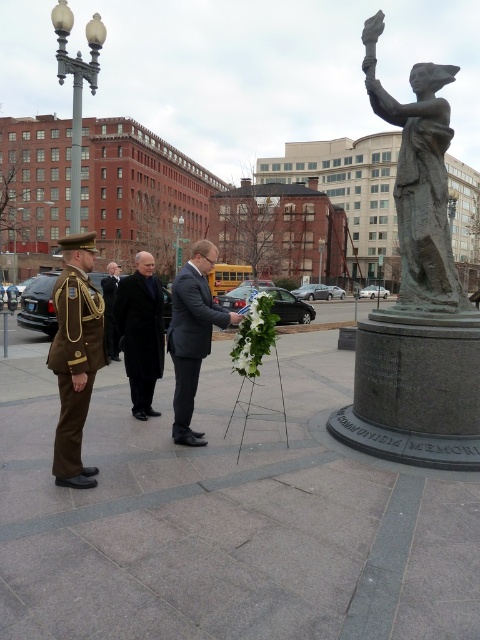
You are a photographer standing at the center of the scene. You want to capture a closeup shot of the statue on the right side of the frame. However, there is an object blocking your view at point (x=74, y=362). What is the object blocking your view?

The brown fabric uniform at left is located at point (x=74, y=362), so the object blocking your view is the brown fabric uniform at left.

In the scene shown: What does the point at coordinate (420, 180) indicate in the image?

The point at coordinate (420, 180) marks the bronze statue at right.

You are a photographer positioned at the center of the scene. You want to take a picture of the bronze statue at right while also capturing the military man in the foreground. Based on their positions, can you frame both subjects in your camera viewfinder without moving either subject?

The bronze statue at right is located at point (420, 180). Since the statue is positioned on the right side of the frame and the military man is in the foreground to the left, it should be possible to frame both in the camera viewfinder by adjusting the zoom or angle to include both the statue on the right and the military man on the left without moving either subject.